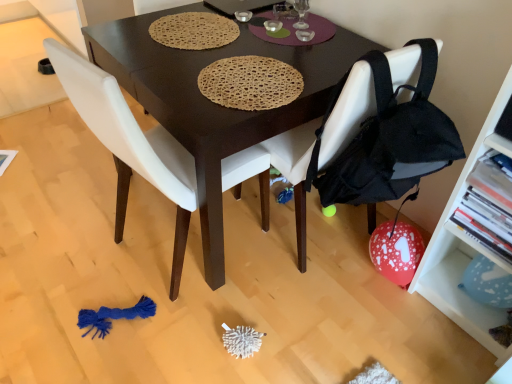
Question: Is black fabric chair at lower right, which is the second chair from left to right, thinner than white matte chair at center, marked as the 1th chair in a left-to-right arrangement?

Choices:
 (A) yes
 (B) no

Answer: (A)

Question: Considering the relative positions of black fabric chair at lower right, acting as the first chair starting from the right, and white matte chair at center, which ranks as the second chair in right-to-left order, in the image provided, is black fabric chair at lower right, acting as the first chair starting from the right, in front of white matte chair at center, which ranks as the second chair in right-to-left order,?

Choices:
 (A) no
 (B) yes

Answer: (A)

Question: Is black fabric chair at lower right, acting as the first chair starting from the right, positioned beyond the bounds of white matte chair at center, which ranks as the second chair in right-to-left order?

Choices:
 (A) no
 (B) yes

Answer: (B)

Question: Are black fabric chair at lower right, which is the second chair from left to right, and white matte chair at center, marked as the 1th chair in a left-to-right arrangement, far apart?

Choices:
 (A) no
 (B) yes

Answer: (A)

Question: Considering the relative positions of black fabric chair at lower right, which is the second chair from left to right, and white matte chair at center, marked as the 1th chair in a left-to-right arrangement, in the image provided, is black fabric chair at lower right, which is the second chair from left to right, to the left of white matte chair at center, marked as the 1th chair in a left-to-right arrangement, from the viewer's perspective?

Choices:
 (A) no
 (B) yes

Answer: (A)

Question: From the image's perspective, relative to black fabric chair at lower right, acting as the first chair starting from the right, is white matte shelf at right above or below?

Choices:
 (A) below
 (B) above

Answer: (A)

Question: Based on their positions, is white matte shelf at right located to the left or right of black fabric chair at lower right, acting as the first chair starting from the right?

Choices:
 (A) left
 (B) right

Answer: (B)

Question: Is white matte shelf at right situated inside black fabric chair at lower right, which is the second chair from left to right, or outside?

Choices:
 (A) outside
 (B) inside

Answer: (A)

Question: Is white matte shelf at right in front of or behind black fabric chair at lower right, acting as the first chair starting from the right, in the image?

Choices:
 (A) front
 (B) behind

Answer: (A)

Question: Is white matte chair at center, which ranks as the second chair in right-to-left order, situated inside white matte shelf at right or outside?

Choices:
 (A) outside
 (B) inside

Answer: (A)

Question: Looking at the image, does white matte chair at center, marked as the 1th chair in a left-to-right arrangement, seem bigger or smaller compared to white matte shelf at right?

Choices:
 (A) small
 (B) big

Answer: (B)

Question: In terms of height, does white matte chair at center, which ranks as the second chair in right-to-left order, look taller or shorter compared to white matte shelf at right?

Choices:
 (A) tall
 (B) short

Answer: (B)

Question: Considering the positions of point (78, 72) and point (501, 264), is point (78, 72) closer or farther from the camera than point (501, 264)?

Choices:
 (A) farther
 (B) closer

Answer: (B)

Question: Looking at their shapes, would you say white matte chair at center, which ranks as the second chair in right-to-left order, is wider or thinner than dark brown wood desk at center?

Choices:
 (A) thin
 (B) wide

Answer: (A)

Question: Visually, is white matte chair at center, marked as the 1th chair in a left-to-right arrangement, positioned to the left or to the right of dark brown wood desk at center?

Choices:
 (A) right
 (B) left

Answer: (B)